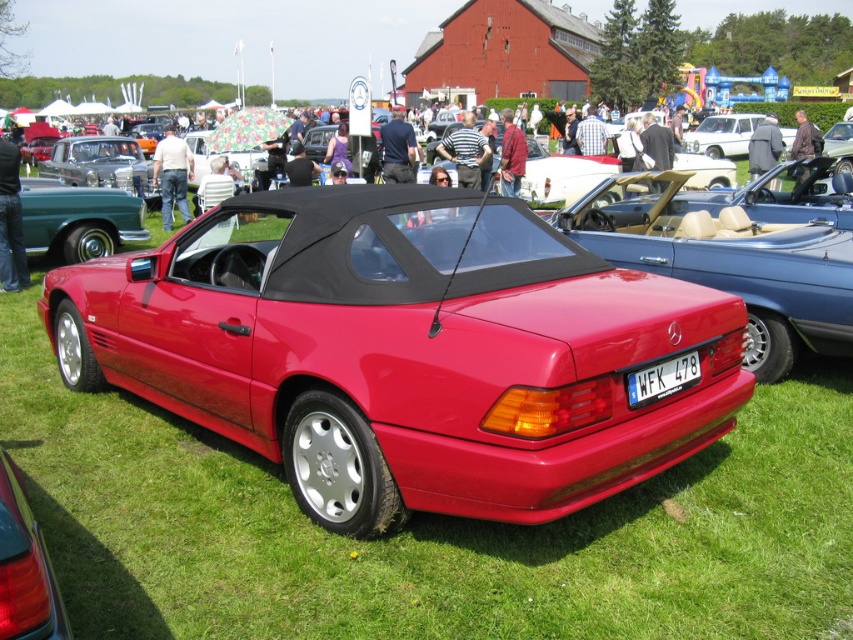
You are a photographer at the car show and want to capture the metallic silver convertible at center and the white plastic license plate at center in a single shot. Can you frame the shot so that both objects are visible without moving your camera position?

The metallic silver convertible at center is above the white plastic license plate at center, so yes, you can frame the shot so that both objects are visible without moving your camera position because the convertible is positioned higher up relative to the license plate.

You are a photographer at the car show and want to capture the matte red convertible at center and the white plastic license plate at center in a single shot. Which object will appear larger in the photo?

The matte red convertible at center is taller than the white plastic license plate at center, so it will appear larger in the photo.

You are a photographer planning to capture both the matte red convertible at center and the metallic silver convertible at center in a single frame. Given that your camera has a fixed focal length, which car should you position closer to the camera to ensure both fit in the frame without cropping?

The matte red convertible at center is narrower than the metallic silver convertible at center. To fit both in the frame without cropping, position the wider metallic silver convertible at center closer to the camera so its increased width fills the space appropriately, while the narrower matte red convertible at center can be placed slightly farther back. This arrangement balances their sizes within the frame.